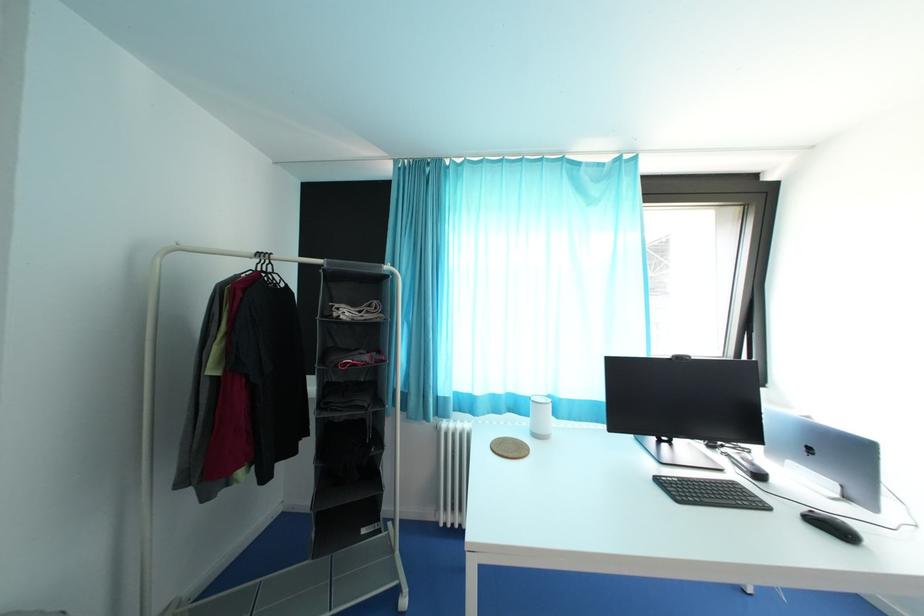
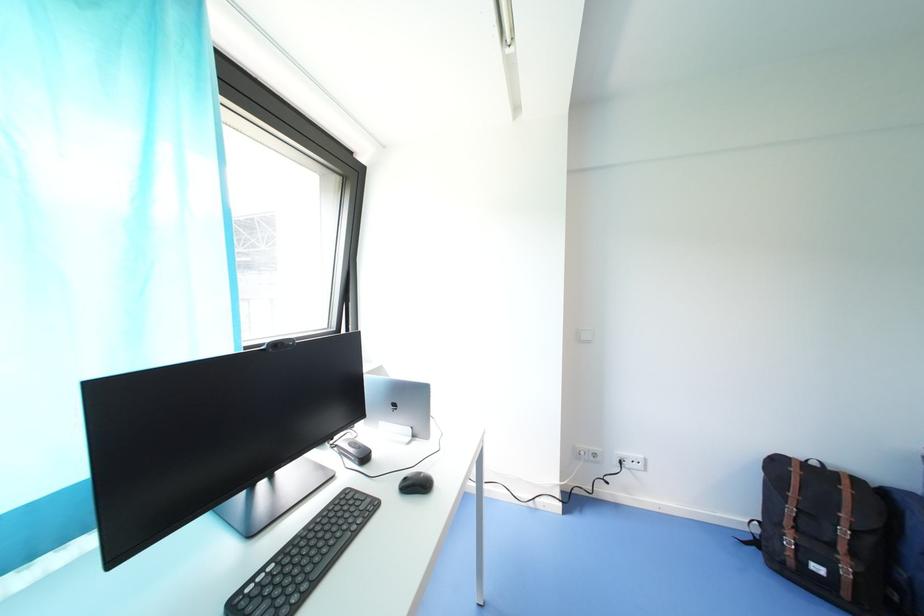
Question: The first image is from the beginning of the video and the second image is from the end. How did the camera likely rotate when shooting the video?

Choices:
 (A) Left
 (B) Right
 (C) Up
 (D) Down

Answer: (B)